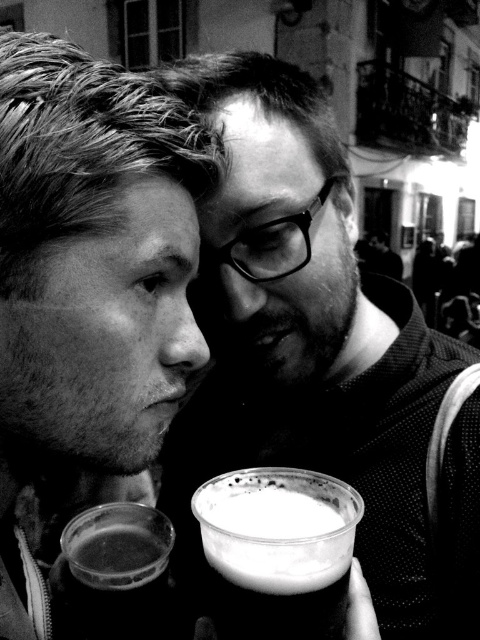
Question: Which object appears closest to the camera in this image?

Choices:
 (A) foamy dark beer at lower center
 (B) matte plastic cup at center
 (C) smooth skin face at left
 (D) translucent plastic cup at lower left

Answer: (C)

Question: Does matte plastic cup at center appear over smooth skin face at left?

Choices:
 (A) yes
 (B) no

Answer: (A)

Question: Which of the following is the closest to the observer?

Choices:
 (A) translucent plastic cup at lower left
 (B) foamy dark beer at lower center
 (C) smooth skin face at left

Answer: (C)

Question: Does foamy dark beer at lower center have a lesser width compared to translucent plastic cup at lower left?

Choices:
 (A) yes
 (B) no

Answer: (B)

Question: Can you confirm if smooth skin face at left is positioned below translucent plastic cup at lower left?

Choices:
 (A) no
 (B) yes

Answer: (A)

Question: Estimate the real-world distances between objects in this image. Which object is farther from the smooth skin face at left?

Choices:
 (A) matte plastic cup at center
 (B) foamy dark beer at lower center
 (C) translucent plastic cup at lower left

Answer: (C)